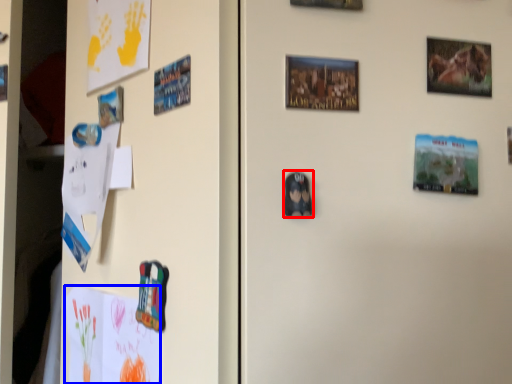
Question: Which of the following is the closest to the observer, print (highlighted by a red box) or postcard (highlighted by a blue box)?

Choices:
 (A) print
 (B) postcard

Answer: (A)